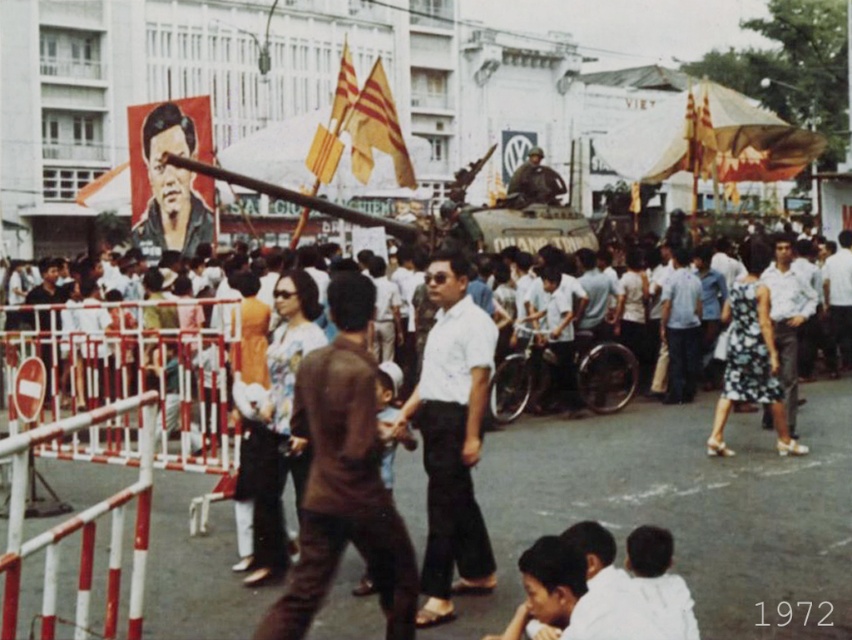
You are a photographer standing on the street and see the white matte shirt at center and the green camouflage tank at center. Which object is closer to the ground?

The white matte shirt at center is below the green camouflage tank at center, so it is closer to the ground.